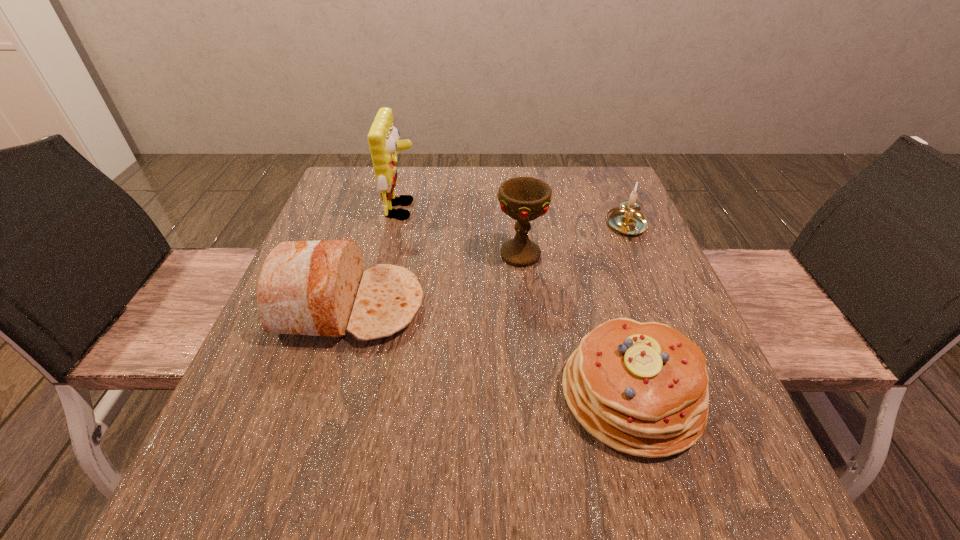
The width and height of the screenshot is (960, 540). In order to click on sponge that is at the far edge in this screenshot , I will do `click(383, 138)`.

Where is `candle holder present at the far edge`? The height and width of the screenshot is (540, 960). candle holder present at the far edge is located at coordinates (626, 219).

This screenshot has height=540, width=960. In order to click on object at the left edge in this screenshot , I will do `click(319, 288)`.

At what (x,y) coordinates should I click in order to perform the action: click on candle holder that is at the right edge. Please return your answer as a coordinate pair (x, y). Looking at the image, I should click on (626, 219).

Locate an element on the screen. The height and width of the screenshot is (540, 960). pancake that is at the right edge is located at coordinates (641, 388).

Identify the location of object that is at the far right corner. This screenshot has height=540, width=960. (626, 219).

Where is `blank area at the far edge`? The height and width of the screenshot is (540, 960). blank area at the far edge is located at coordinates (497, 192).

Image resolution: width=960 pixels, height=540 pixels. In the image, there is a desktop. In order to click on vacant space at the near edge in this screenshot , I will do `click(331, 472)`.

At what (x,y) coordinates should I click in order to perform the action: click on blank space at the left edge. Please return your answer as a coordinate pair (x, y). Looking at the image, I should click on (308, 372).

Image resolution: width=960 pixels, height=540 pixels. Find the location of `free region at the right edge of the desktop`. free region at the right edge of the desktop is located at coordinates (623, 241).